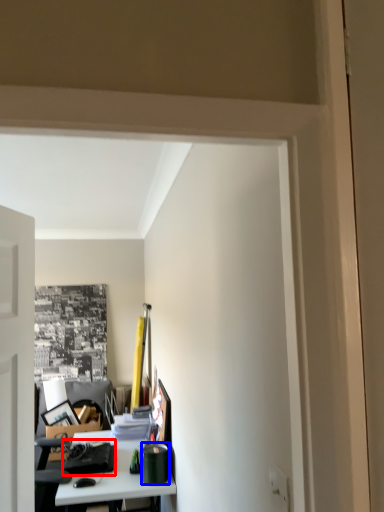
Question: Which object appears farthest to the camera in this image, stationery (highlighted by a red box) or stationery (highlighted by a blue box)?

Choices:
 (A) stationery
 (B) stationery

Answer: (A)